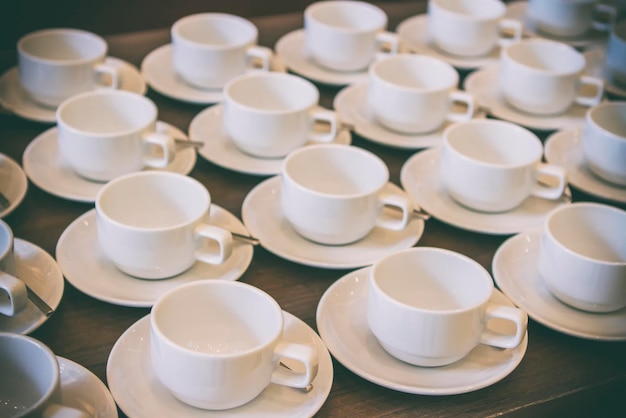
Where is `spoons`? The height and width of the screenshot is (418, 626). spoons is located at coordinates (38, 300), (3, 201), (183, 141), (240, 235), (310, 389), (422, 214).